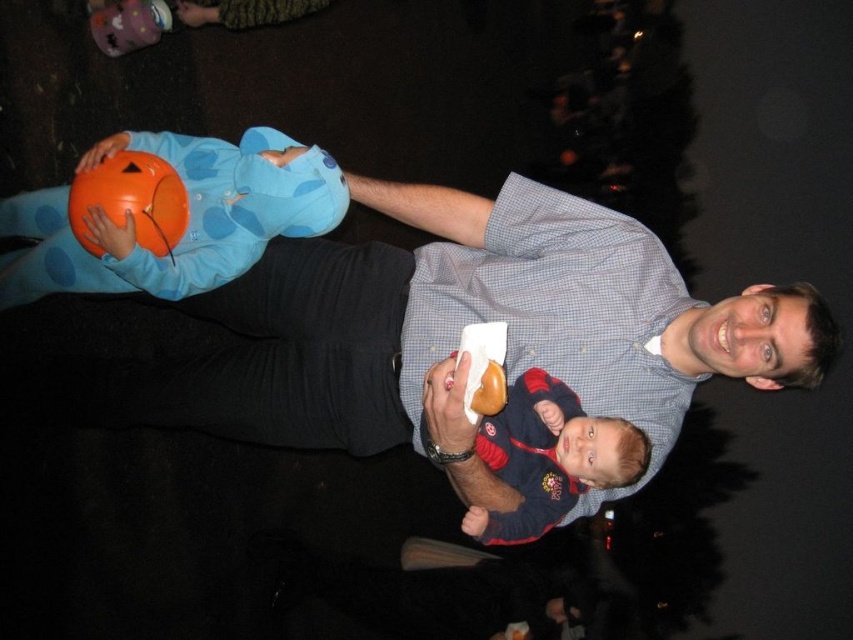
Does blue polka dot costume at left appear on the left side of matte blue sweater at center?

Indeed, blue polka dot costume at left is positioned on the left side of matte blue sweater at center.

Based on the photo, can you confirm if blue polka dot costume at left is positioned below matte blue sweater at center?

No, blue polka dot costume at left is not below matte blue sweater at center.

Is point (16, 292) positioned in front of point (529, 508)?

That is False.

The height and width of the screenshot is (640, 853). What are the coordinates of `blue polka dot costume at left` in the screenshot? It's located at click(187, 221).

From the picture: Is matte blue shirt at center behind matte blue sweater at center?

That is True.

Between point (645, 365) and point (480, 524), which one is positioned in front?

Point (480, 524) is in front.

Is point (573, 269) positioned behind point (531, 480)?

Yes, it is behind point (531, 480).

Locate an element on the screen. The width and height of the screenshot is (853, 640). matte blue shirt at center is located at coordinates (416, 333).

Does matte blue shirt at center lie behind blue polka dot costume at left?

No, matte blue shirt at center is closer to the viewer.

Is point (477, 204) positioned behind point (28, 292)?

That is False.

Which is in front, point (276, 356) or point (300, 230)?

Point (300, 230)

The width and height of the screenshot is (853, 640). What are the coordinates of `matte blue shirt at center` in the screenshot? It's located at coord(416,333).